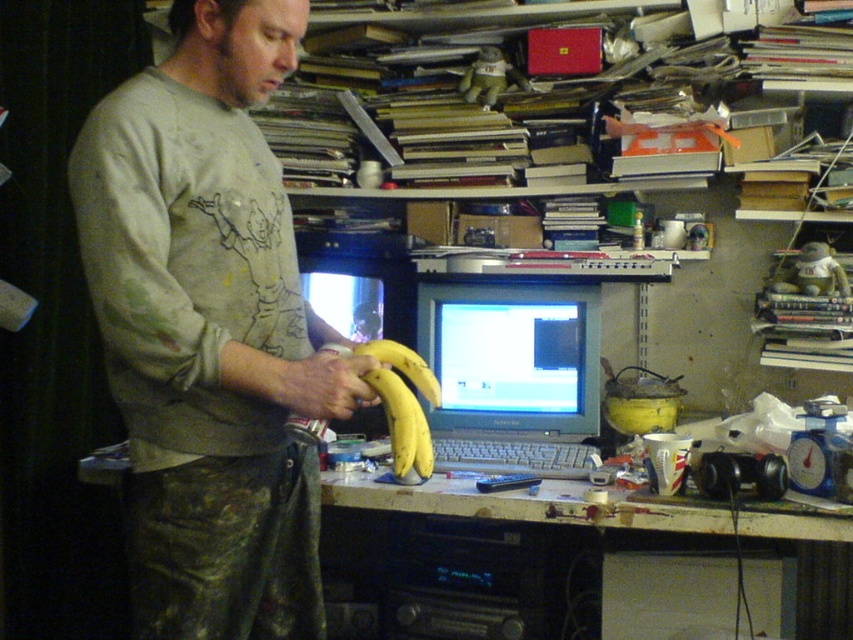
Question: From the image, what is the correct spatial relationship of light gray sweatshirt at center in relation to yellow matte bananas at center?

Choices:
 (A) left
 (B) right

Answer: (A)

Question: Can you confirm if matte gray monitor at center is positioned below white plastic computer desk at center?

Choices:
 (A) no
 (B) yes

Answer: (A)

Question: Which object appears farthest from the camera in this image?

Choices:
 (A) matte gray monitor at center
 (B) yellow matte banana at center

Answer: (A)

Question: Where is light gray sweatshirt at center located in relation to yellow matte bananas at center in the image?

Choices:
 (A) right
 (B) left

Answer: (B)

Question: Considering the real-world distances, which object is closest to the yellow matte banana at center?

Choices:
 (A) white plastic computer desk at center
 (B) light gray sweatshirt at center
 (C) matte gray monitor at center
 (D) yellow matte bananas at center

Answer: (D)

Question: Which object is the closest to the white plastic computer desk at center?

Choices:
 (A) yellow matte bananas at center
 (B) matte gray monitor at center

Answer: (B)